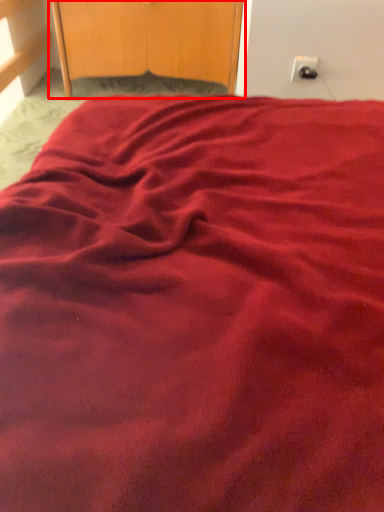
Question: From the image's perspective, what is the correct spatial relationship of dresser (annotated by the red box) in relation to electric outlet?

Choices:
 (A) above
 (B) below

Answer: (A)